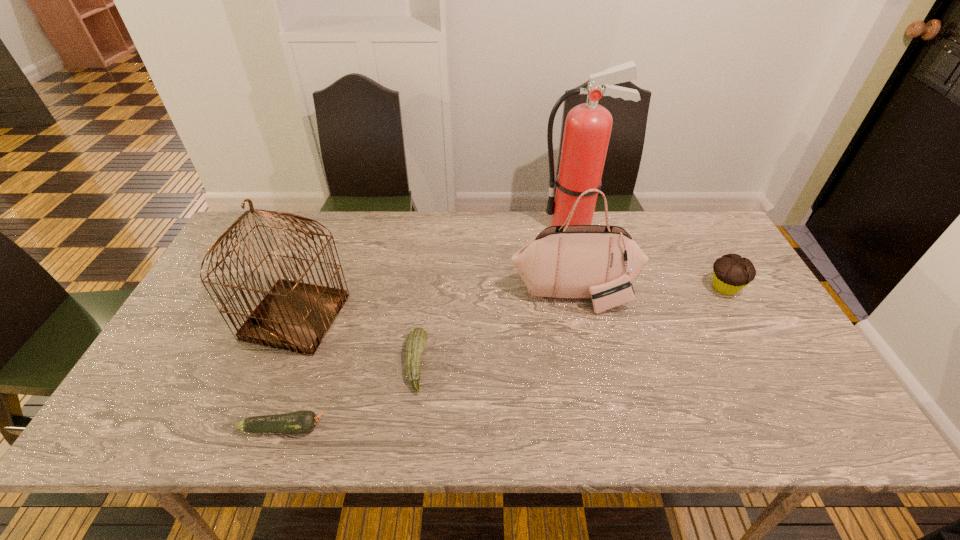
Identify the location of vacant space that satisfies the following two spatial constraints: 1. on the back side of the muffin; 2. on the hose direction of the farthest object. (690, 225).

Where is `free spot that satisfies the following two spatial constraints: 1. on the side of the handbag with the attached pouch; 2. at the stem end of the fourth object from right to left`? The image size is (960, 540). free spot that satisfies the following two spatial constraints: 1. on the side of the handbag with the attached pouch; 2. at the stem end of the fourth object from right to left is located at coordinates (589, 363).

The height and width of the screenshot is (540, 960). Identify the location of free spot that satisfies the following two spatial constraints: 1. on the hose direction of the tallest object; 2. on the front side of the birdcage. (595, 317).

Locate an element on the screen. The width and height of the screenshot is (960, 540). free space that satisfies the following two spatial constraints: 1. on the side of the handbag with the attached pouch; 2. at the blossom end of the left zucchini is located at coordinates (603, 428).